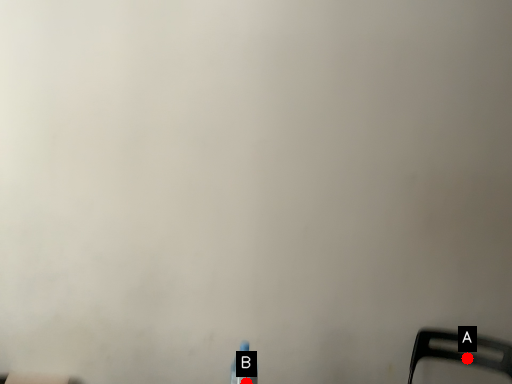
Question: Two points are circled on the image, labeled by A and B beside each circle. Which point is farther to the camera?

Choices:
 (A) A is further
 (B) B is further

Answer: (A)